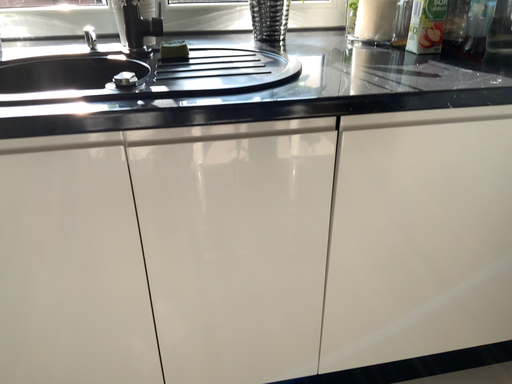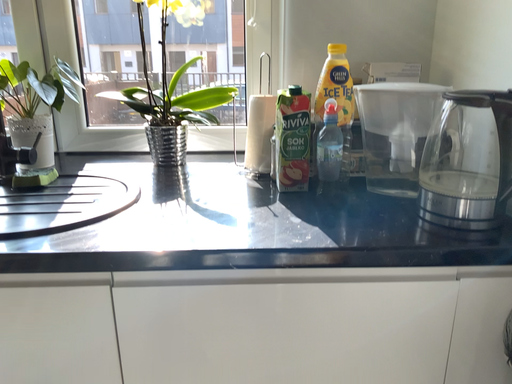
Question: How did the camera likely rotate when shooting the video?

Choices:
 (A) rotated downward
 (B) rotated upward

Answer: (B)